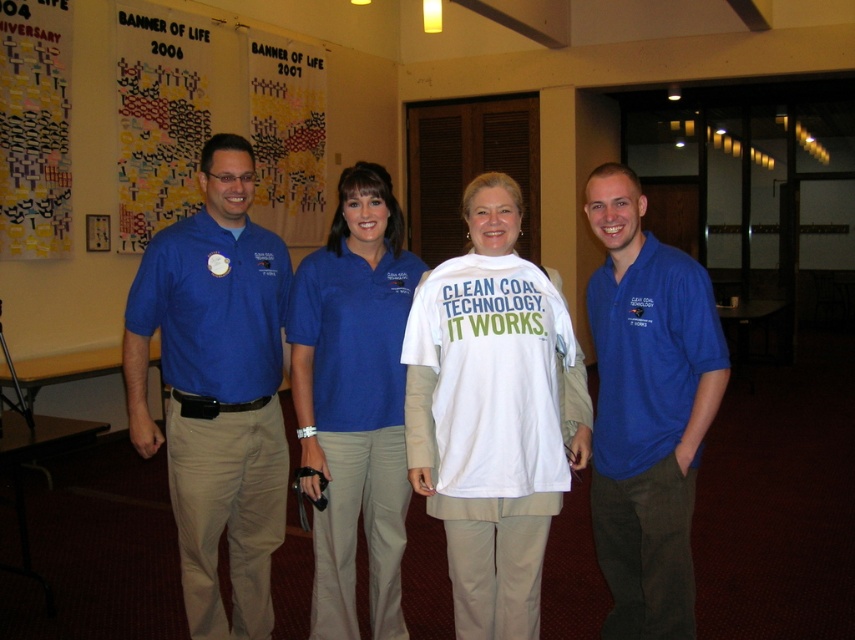
Between matte blue polo shirt at left and white cotton shirt at center, which one has less height?

white cotton shirt at center is shorter.

Which is behind, point (202, 468) or point (488, 593)?

Positioned behind is point (202, 468).

Who is more distant from viewer, [210,156] or [558,428]?

Positioned behind is point [210,156].

I want to click on matte blue polo shirt at left, so click(216, 388).

Between white cotton shirt at center and matte blue polo shirt at right, which one is positioned higher?

matte blue polo shirt at right

Which of these two, white cotton shirt at center or matte blue polo shirt at right, stands taller?

matte blue polo shirt at right is taller.

This screenshot has width=855, height=640. Describe the element at coordinates (492, 428) in the screenshot. I see `white cotton shirt at center` at that location.

This screenshot has width=855, height=640. Identify the location of white cotton shirt at center. (492, 428).

Does matte blue polo shirt at right have a lesser width compared to matte blue polo shirt at center?

Yes, matte blue polo shirt at right is thinner than matte blue polo shirt at center.

Looking at this image, who is higher up, matte blue polo shirt at right or matte blue polo shirt at center?

matte blue polo shirt at right

What do you see at coordinates (647, 410) in the screenshot? This screenshot has width=855, height=640. I see `matte blue polo shirt at right` at bounding box center [647, 410].

Where is `matte blue polo shirt at right`? Image resolution: width=855 pixels, height=640 pixels. matte blue polo shirt at right is located at coordinates (647, 410).